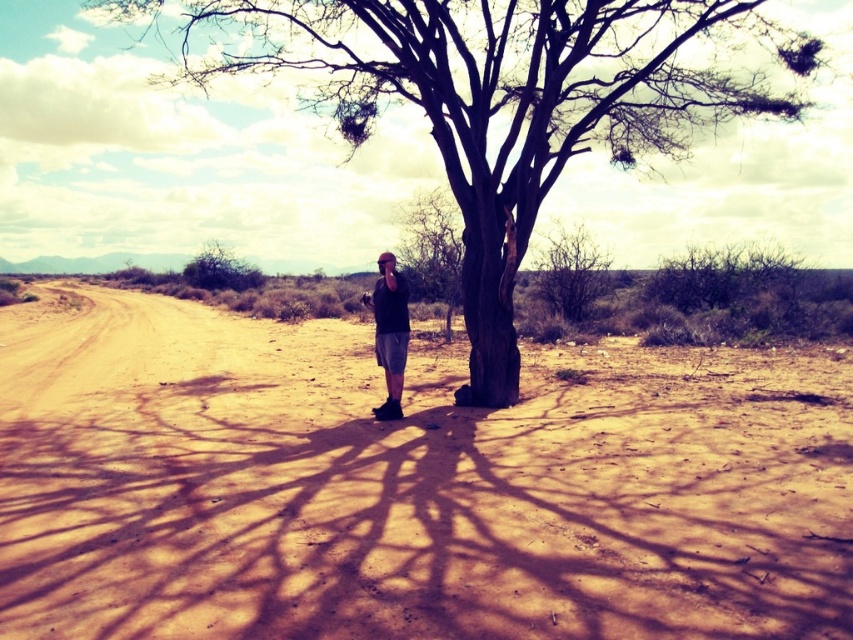
Is bare wood tree at center shorter than green leafy bush at upper left?

No, bare wood tree at center is not shorter than green leafy bush at upper left.

Can you confirm if bare wood tree at center is positioned above green leafy bush at upper left?

No, bare wood tree at center is not above green leafy bush at upper left.

Between point (576, 237) and point (225, 289), which one is positioned in front?

Point (576, 237) is in front.

Locate an element on the screen. bare wood tree at center is located at coordinates (572, 273).

The width and height of the screenshot is (853, 640). What are the coordinates of `brown rough bark tree at center` in the screenshot? It's located at (503, 102).

Who is positioned more to the right, brown rough bark tree at center or green leafy bush at upper left?

Positioned to the right is brown rough bark tree at center.

What do you see at coordinates (503, 102) in the screenshot? The image size is (853, 640). I see `brown rough bark tree at center` at bounding box center [503, 102].

The height and width of the screenshot is (640, 853). Identify the location of brown rough bark tree at center. (503, 102).

Does matte black shirt at center have a greater width compared to green leafy bush at upper left?

In fact, matte black shirt at center might be narrower than green leafy bush at upper left.

Looking at this image, between matte black shirt at center and green leafy bush at upper left, which one appears on the left side from the viewer's perspective?

From the viewer's perspective, green leafy bush at upper left appears more on the left side.

Which is behind, point (383, 304) or point (218, 248)?

Positioned behind is point (218, 248).

I want to click on matte black shirt at center, so click(x=389, y=332).